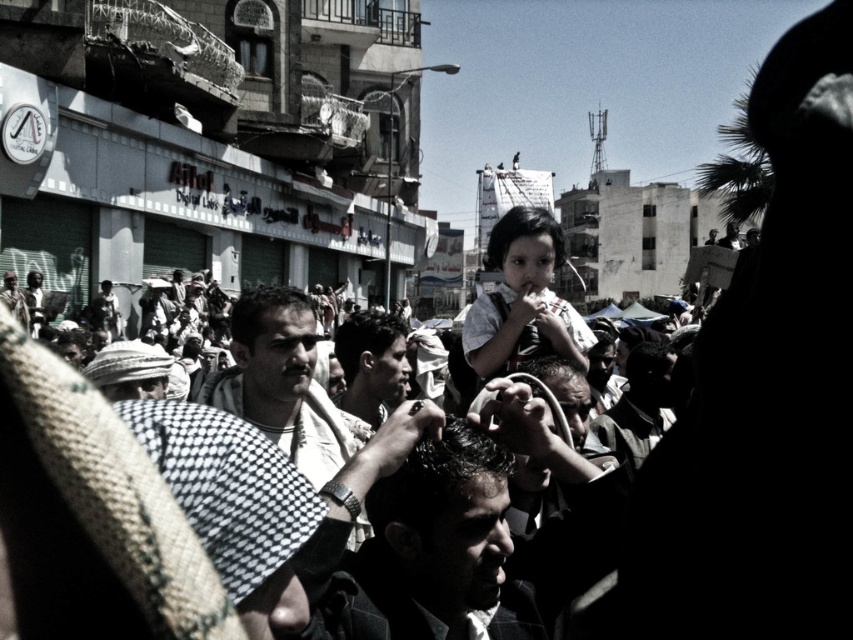
You are standing at point A located at coordinates point A at [459,500]. You want to walk to point B located at coordinates point B at 0.312, 0.891. The path between these two points is a straight line. Given that you can walk at a speed of 1.5 meters per second, how long will it take you to reach point B from point A?

The distance between point A at [459,500] and point B at 0.312, 0.891 is 35.46 meters. At a walking speed of 1.5 meters per second, it will take approximately 23.64 seconds to reach point B.

You are a photographer at the event and need to capture a clear photo of the smooth skin face at center without the matte white shirt at center blocking it. Is this possible?

The matte white shirt at center is above the smooth skin face at center, so the shirt will block the face in the photo.